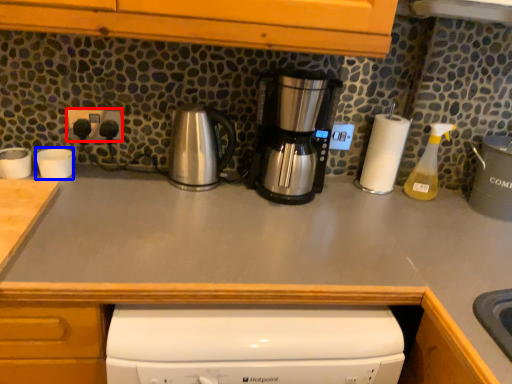
Question: Among these objects, which one is nearest to the camera, electric outlet (highlighted by a red box) or appliance (highlighted by a blue box)?

Choices:
 (A) electric outlet
 (B) appliance

Answer: (B)